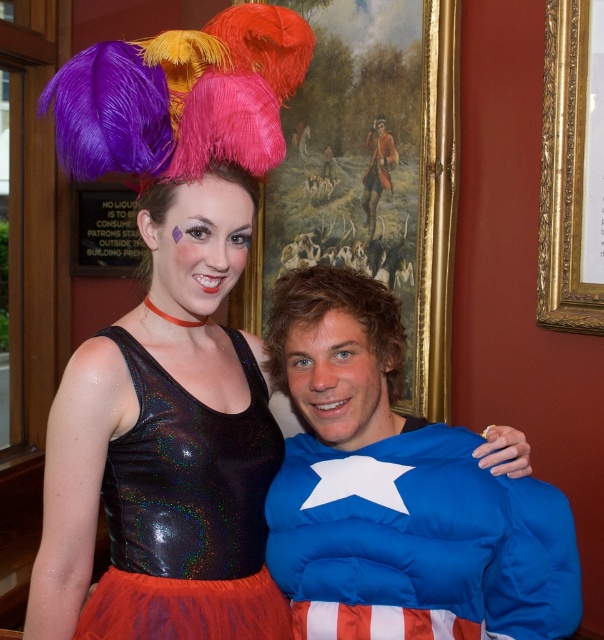
You are at a costume party and need to take a photo with both the blue padded costume at center and the holographic sequin leotard at center. Where should you position yourself relative to the two costumes to ensure both are in the frame?

Position yourself to the left of the holographic sequin leotard at center so that the blue padded costume at center, which is to the right of the holographic sequin leotard at center, stays in frame along with it.

You are taking a photo of two people standing in front of you. The first person is at point (349,269) and the second is at point (210,492). Which person is closer to your camera?

The person at point (349,269) is closer to the camera than the person at point (210,492).

You are a photographer at a costume party. You need to position the blue padded costume at center and the holographic sequin leotard at center so that both can fit within a 2.5 meter wide photo backdrop. Can you arrange them side by side without overlapping?

The blue padded costume at center might be wider than the holographic sequin leotard at center. If the total width of both exceeds 2.5 meters, they might not fit side by side. Measure their combined width to confirm.